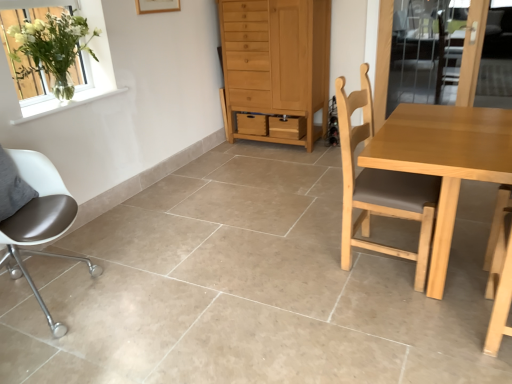
Question: Based on their positions, is light brown wooden table at right located to the left or right of matte brown chair at left, the first chair when ordered from left to right?

Choices:
 (A) left
 (B) right

Answer: (B)

Question: Considering the positions of light brown wooden table at right and matte brown chair at left, the first chair when ordered from left to right, in the image, is light brown wooden table at right bigger or smaller than matte brown chair at left, the first chair when ordered from left to right,?

Choices:
 (A) small
 (B) big

Answer: (B)

Question: Estimate the real-world distances between objects in this image. Which object is farther from the light brown wooden table at right?

Choices:
 (A) light brown wood cabinet at center
 (B) light brown wood chair at center, the 1th chair in the right-to-left sequence
 (C) clear glass vase at upper left
 (D) matte brown chair at left, positioned as the 2th chair in right-to-left order
 (E) clear glass screen door at upper right

Answer: (C)

Question: Which object is positioned farthest from the matte brown chair at left, the first chair when ordered from left to right?

Choices:
 (A) clear glass vase at upper left
 (B) light brown wood cabinet at center
 (C) light brown wooden table at right
 (D) clear glass screen door at upper right
 (E) light brown wood chair at center, positioned as the second chair in left-to-right order

Answer: (D)